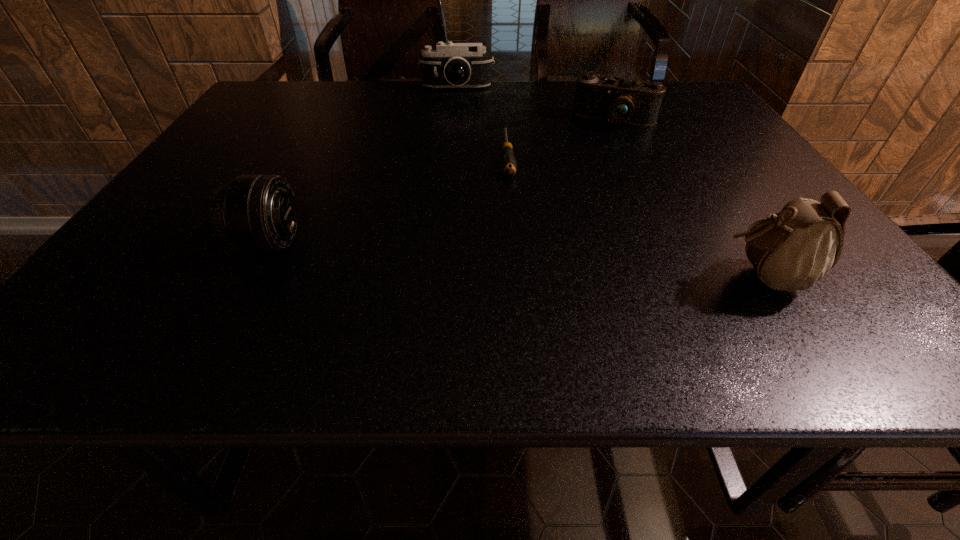
Locate an element on the screen. The height and width of the screenshot is (540, 960). vacant point located on the front lens of the left camera is located at coordinates (458, 112).

Find the location of a particular element. This screenshot has height=540, width=960. telephoto lens present at the near edge is located at coordinates (255, 212).

Identify the location of pouch at the near edge. The width and height of the screenshot is (960, 540). (791, 250).

You are a GUI agent. You are given a task and a screenshot of the screen. Output one action in this format:
    pyautogui.click(x=<x>, y=<y>)
    Task: Click on the object that is positioned at the right edge
    Image resolution: width=960 pixels, height=540 pixels.
    Given the screenshot: What is the action you would take?
    pyautogui.click(x=791, y=250)

Locate an element on the screen. Image resolution: width=960 pixels, height=540 pixels. object located at the near right corner is located at coordinates (791, 250).

In the image, there is a desktop. What are the coordinates of `vacant space at the far edge` in the screenshot? It's located at (341, 89).

This screenshot has height=540, width=960. In the image, there is a desktop. Identify the location of blank space at the near edge. (641, 284).

The image size is (960, 540). In order to click on vacant area at the left edge in this screenshot , I will do `click(270, 137)`.

You are a GUI agent. You are given a task and a screenshot of the screen. Output one action in this format:
    pyautogui.click(x=<x>, y=<y>)
    Task: Click on the vacant space at the right edge
    The width and height of the screenshot is (960, 540).
    Given the screenshot: What is the action you would take?
    pyautogui.click(x=682, y=144)

Where is `vacant space at the far left corner of the desktop`? The height and width of the screenshot is (540, 960). vacant space at the far left corner of the desktop is located at coordinates (268, 95).